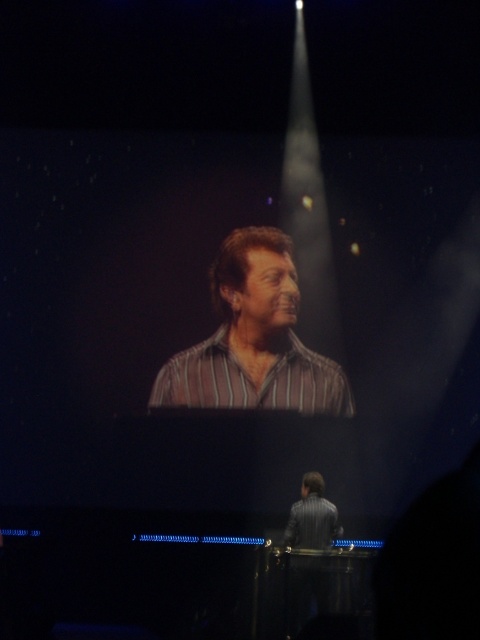
Question: Among these objects, which one is farthest from the camera?

Choices:
 (A) striped cotton shirt at center
 (B) striped shirt at center
 (C) striped fabric shirt at lower center

Answer: (B)

Question: Based on their relative distances, which object is nearer to the striped fabric shirt at lower center?

Choices:
 (A) striped cotton shirt at center
 (B) striped shirt at center

Answer: (A)

Question: Observing the image, what is the correct spatial positioning of striped shirt at center in reference to striped fabric shirt at lower center?

Choices:
 (A) left
 (B) right

Answer: (A)

Question: Can you confirm if striped shirt at center is smaller than striped fabric shirt at lower center?

Choices:
 (A) yes
 (B) no

Answer: (B)

Question: Does striped shirt at center have a larger size compared to striped fabric shirt at lower center?

Choices:
 (A) no
 (B) yes

Answer: (B)

Question: Among these points, which one is farthest from the camera?

Choices:
 (A) (294, 333)
 (B) (344, 381)

Answer: (A)